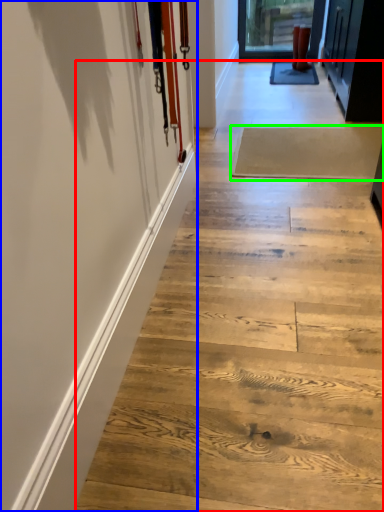
Question: Based on their relative distances, which object is nearer to stair (highlighted by a red box)? Choose from barn door (highlighted by a blue box) and plank (highlighted by a green box).

Choices:
 (A) barn door
 (B) plank

Answer: (A)